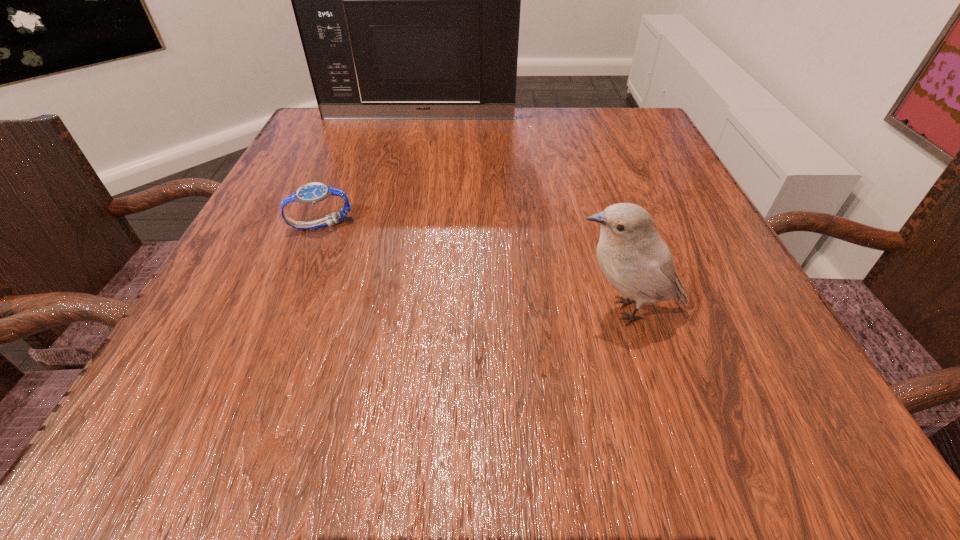
Find the location of a particular element. This screenshot has width=960, height=540. vacant point at the far left corner is located at coordinates (318, 123).

I want to click on vacant region at the near left corner, so click(190, 420).

Image resolution: width=960 pixels, height=540 pixels. In order to click on vacant point at the far right corner in this screenshot , I will do `click(591, 118)`.

The height and width of the screenshot is (540, 960). Find the location of `free spot between the watch and the tallest object`. free spot between the watch and the tallest object is located at coordinates (370, 171).

Locate an element on the screen. The height and width of the screenshot is (540, 960). free space between the microwave oven and the watch is located at coordinates (370, 171).

This screenshot has height=540, width=960. I want to click on vacant point located between the nearest object and the watch, so tap(473, 268).

This screenshot has height=540, width=960. Find the location of `vacant space in between the second shortest object and the farthest object`. vacant space in between the second shortest object and the farthest object is located at coordinates (521, 214).

At what (x,y) coordinates should I click in order to perform the action: click on free point between the rightmost object and the tallest object. Please return your answer as a coordinate pair (x, y). The height and width of the screenshot is (540, 960). Looking at the image, I should click on (521, 214).

Locate an element on the screen. The image size is (960, 540). empty space that is in between the rightmost object and the farthest object is located at coordinates (521, 214).

Identify the location of empty location between the watch and the nearest object. The height and width of the screenshot is (540, 960). (473, 268).